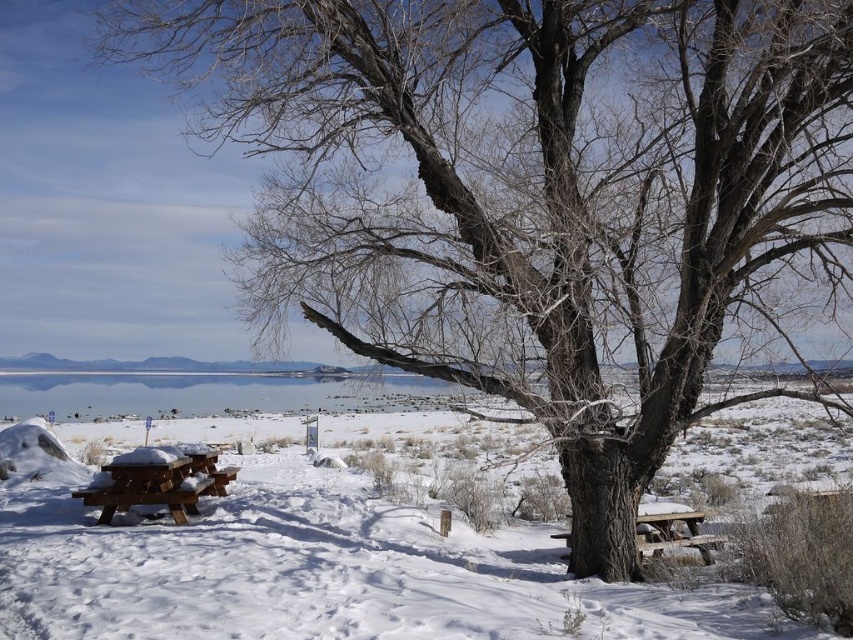
You are standing at the base of the large leafless tree in the winter landscape. You see a point marked at coordinates (317, 566). Where is this point located relative to the snow? Please answer based on the scene description.

The point at (317, 566) is located on the white powdery snow at lower left.

You are planning to build a snowman using the white powdery snow at lower left and the wooden picnic table at lower right. Which object would provide more material for the snowman?

The white powdery snow at lower left is bigger than the wooden picnic table at lower right, so it would provide more material for the snowman.

You are standing at point A and want to walk to point B. You see two points marked in the image, point A is point (120, 432) and point B is point (114, 486). Which point is closer to your current position when you start at point A?

Point A is your starting position, so it is already where you are. However, since you want to go to point B, the closer point would naturally be point A itself. But according to the spatial description, point A is behind point B. This might mean that when moving forward from point A, point B is ahead in your path.